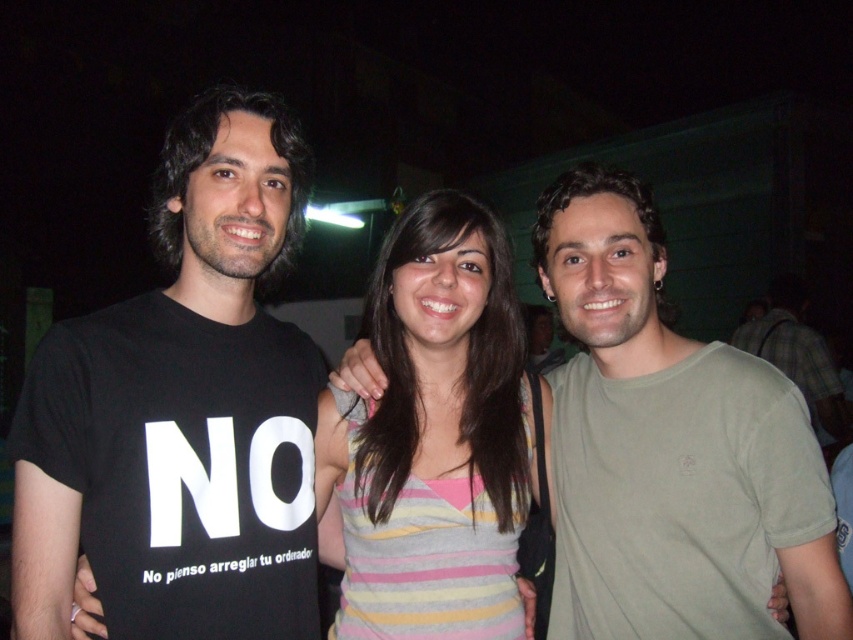
Question: Which object appears closest to the camera in this image?

Choices:
 (A) black cotton t-shirt at left
 (B) matte green t-shirt at center
 (C) green cotton shirt at right
 (D) striped fabric shirt at center

Answer: (A)

Question: From the image, what is the correct spatial relationship of black cotton t-shirt at left in relation to striped fabric shirt at center?

Choices:
 (A) below
 (B) above

Answer: (B)

Question: Can you confirm if black cotton t-shirt at left is wider than matte green t-shirt at center?

Choices:
 (A) no
 (B) yes

Answer: (A)

Question: Estimate the real-world distances between objects in this image. Which object is closer to the black cotton t-shirt at left?

Choices:
 (A) matte green t-shirt at center
 (B) striped fabric shirt at center
 (C) green cotton shirt at right

Answer: (B)

Question: Can you confirm if black cotton t-shirt at left is positioned above green cotton shirt at right?

Choices:
 (A) yes
 (B) no

Answer: (A)

Question: Estimate the real-world distances between objects in this image. Which object is closer to the striped fabric shirt at center?

Choices:
 (A) matte green t-shirt at center
 (B) green cotton shirt at right

Answer: (A)